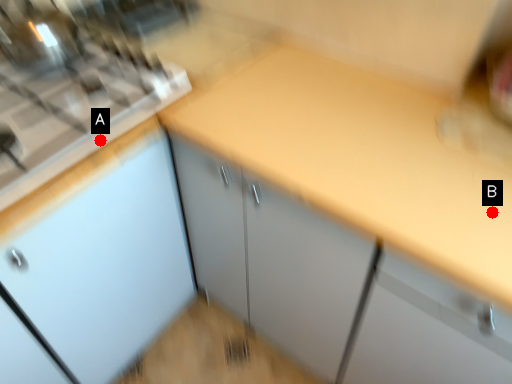
Question: Two points are circled on the image, labeled by A and B beside each circle. Among these points, which one is nearest to the camera?

Choices:
 (A) A is closer
 (B) B is closer

Answer: (B)